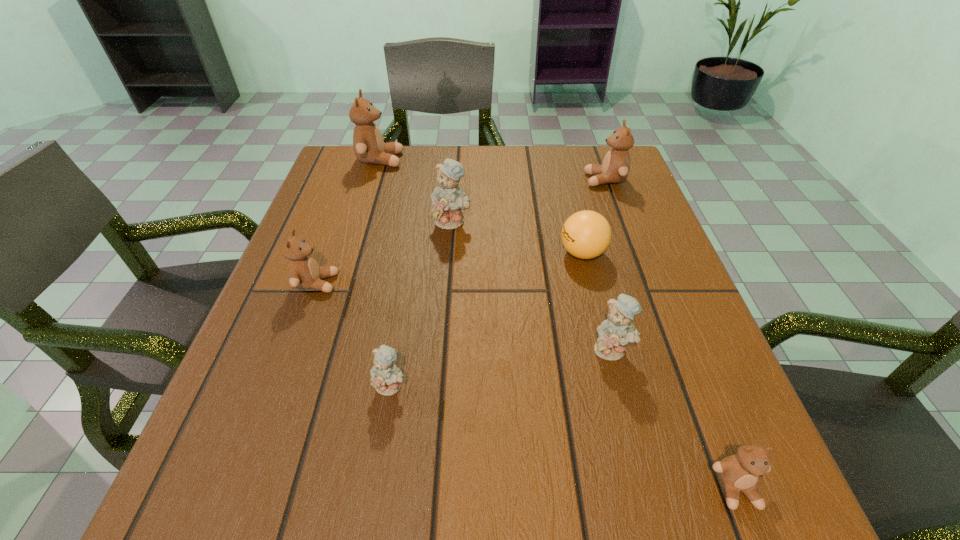
This screenshot has height=540, width=960. What are the coordinates of `vacant space located on the front-facing side of the fifth farthest teddy bear` in the screenshot? It's located at (635, 440).

What are the coordinates of `free space located 0.340m on the side with brand of the ping-pong ball` in the screenshot? It's located at (396, 253).

Where is `vacant space located on the side with brand of the ping-pong ball`? The image size is (960, 540). vacant space located on the side with brand of the ping-pong ball is located at coordinates (463, 253).

Find the location of `vacant region located on the side with brand of the ping-pong ball`. vacant region located on the side with brand of the ping-pong ball is located at coordinates (415, 253).

Identify the location of vacant area located 0.110m on the front-facing side of the fifth teddy bear from right to left. The width and height of the screenshot is (960, 540). (377, 470).

What are the coordinates of `object that is at the near edge` in the screenshot? It's located at (740, 472).

At what (x,y) coordinates should I click in order to perform the action: click on ping-pong ball present at the right edge. Please return your answer as a coordinate pair (x, y). This screenshot has width=960, height=540. Looking at the image, I should click on (586, 234).

Locate an element on the screen. This screenshot has height=540, width=960. object present at the far left corner is located at coordinates (369, 147).

The image size is (960, 540). I want to click on object that is at the far right corner, so click(x=615, y=168).

Identify the location of object that is at the near right corner. The image size is (960, 540). (740, 472).